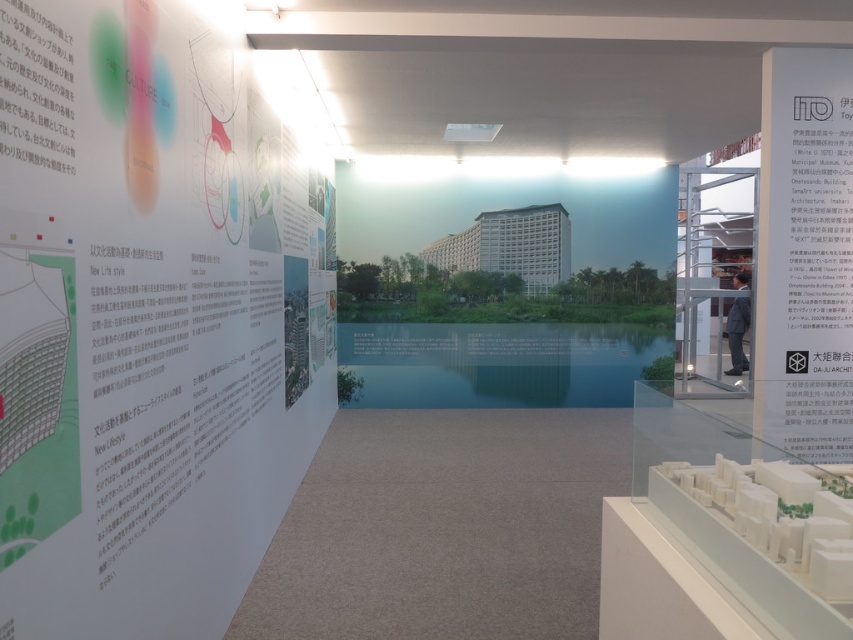
You are a visitor standing in the exhibition space. You want to read the text on the white paper at upper left. Can you read it clearly from your current position?

The white paper at upper left is 1.11 meters away from the camera, so you can read it clearly from your current position.

You are a visitor in the exhibition hall and want to read the information on both the white paper at upper left and the white matte poster at upper right. Which one do you think has more content displayed?

The white matte poster at upper right has more content displayed because it occupies more space than the white paper at upper left.